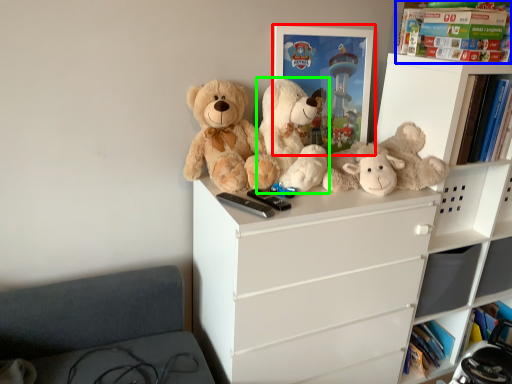
Question: Considering the real-world distances, which object is closest to picture frame (highlighted by a red box)? book (highlighted by a blue box) or teddy bear (highlighted by a green box).

Choices:
 (A) book
 (B) teddy bear

Answer: (B)